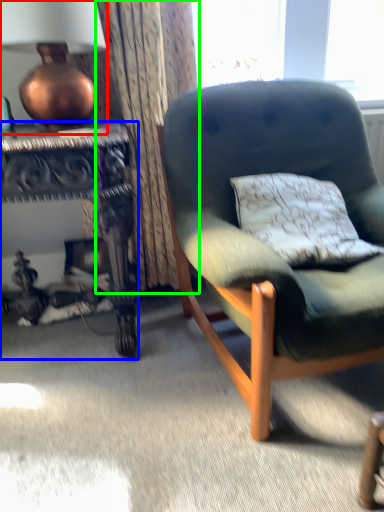
Question: Considering the real-world distances, which object is farthest from lamp (highlighted by a red box)? desk (highlighted by a blue box) or curtain (highlighted by a green box)?

Choices:
 (A) desk
 (B) curtain

Answer: (A)